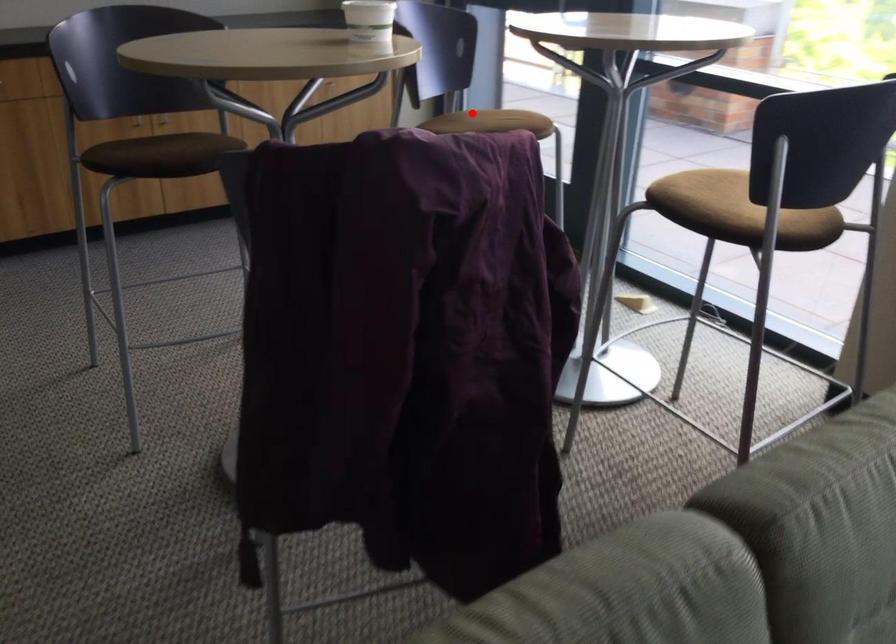
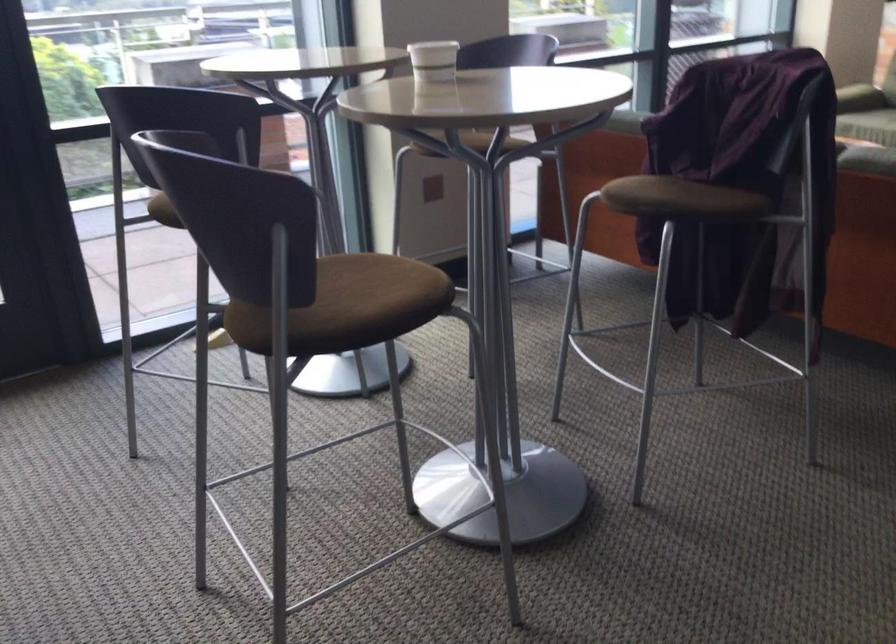
Question: A red point is marked in image1. In image2, is the corresponding 3D point closer to the camera or farther? Reply with the corresponding letter.

Choices:
 (A) The corresponding 3D point is closer.
 (B) The corresponding 3D point is farther.

Answer: (A)